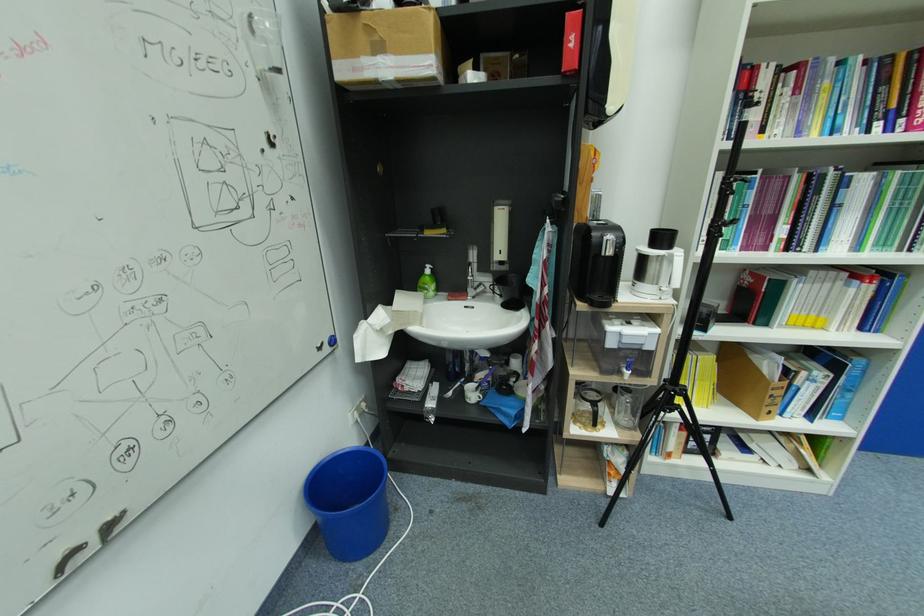
At what (x,y) coordinates should I click in order to perform the action: click on white kettle lid. Please return your answer as a coordinate pair (x, y). The image size is (924, 616). Looking at the image, I should click on (658, 257).